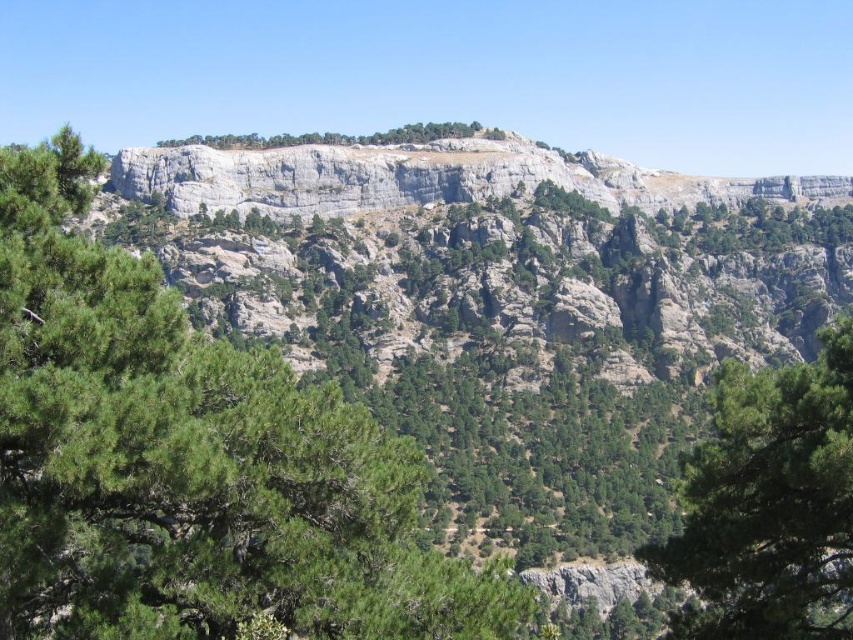
Question: Among these points, which one is nearest to the camera?

Choices:
 (A) (722, 616)
 (B) (170, 508)

Answer: (B)

Question: Does green leafy tree at center appear on the left side of green leafy trees at center?

Choices:
 (A) yes
 (B) no

Answer: (B)

Question: Which point is closer to the camera?

Choices:
 (A) (367, 138)
 (B) (223, 436)

Answer: (B)

Question: Is green textured tree at right bigger than green leafy trees at center?

Choices:
 (A) no
 (B) yes

Answer: (B)

Question: From the image, what is the correct spatial relationship of green textured tree at right in relation to green leafy trees at center?

Choices:
 (A) above
 (B) below

Answer: (B)

Question: Among these objects, which one is nearest to the camera?

Choices:
 (A) green textured tree at right
 (B) green leafy trees at center
 (C) green leafy tree at center

Answer: (C)